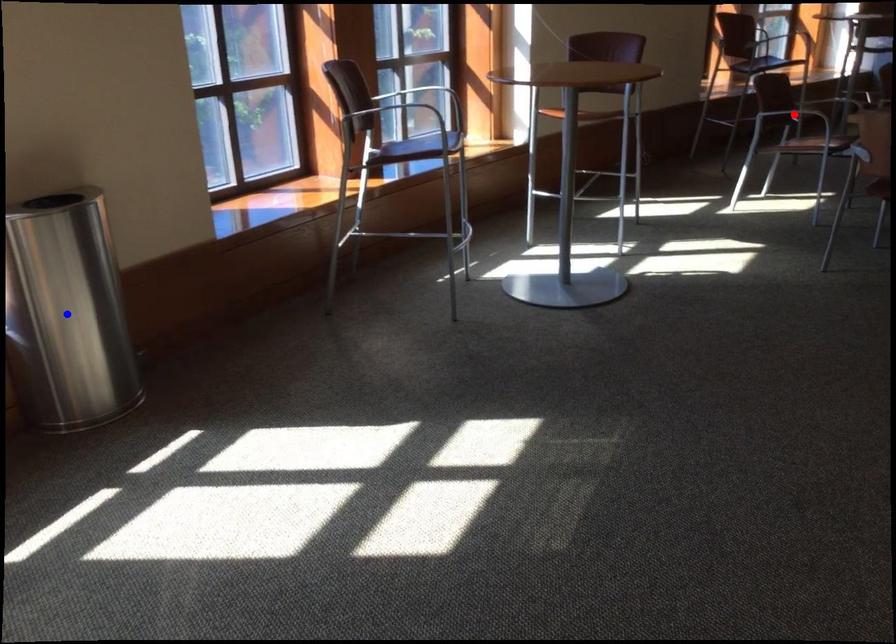
Question: In the image, two points are highlighted. Which point is nearer to the camera? Reply with the corresponding letter.

Choices:
 (A) blue point
 (B) red point

Answer: (A)